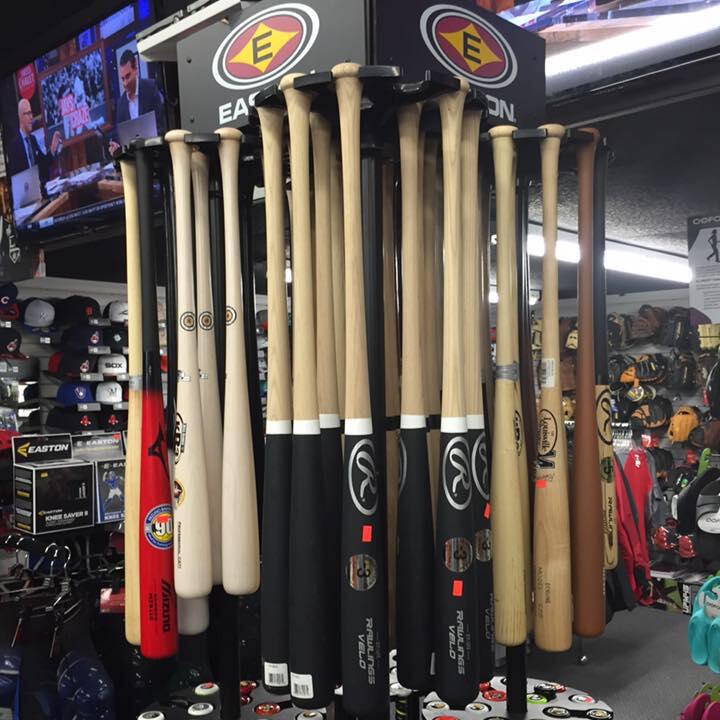
You are a GUI agent. You are given a task and a screenshot of the screen. Output one action in this format:
    pyautogui.click(x=<x>, y=<y>)
    Task: Click on the flourescent lights
    
    Given the screenshot: What is the action you would take?
    pyautogui.click(x=631, y=260), pyautogui.click(x=603, y=45)